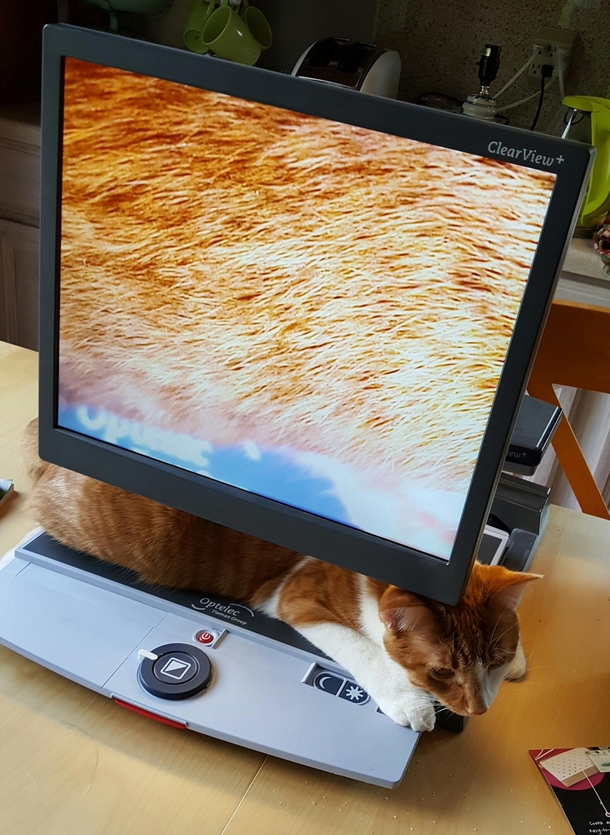
I want to click on led, so click(334, 493).